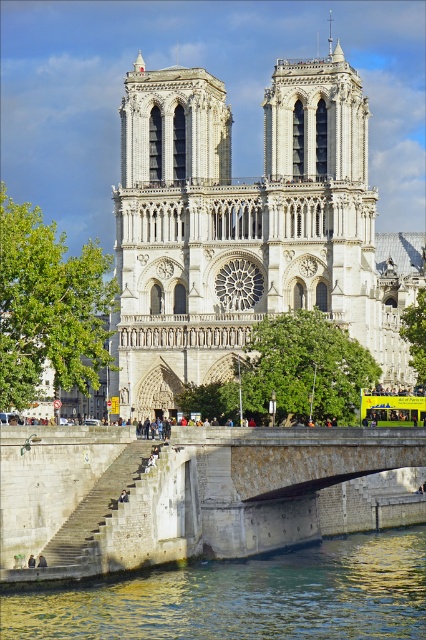
You are standing on the stone bridge at lower center and want to take a photo of the white stone cathedral at center. Which direction should you look to capture the cathedral in your photo?

You should look upward because the white stone cathedral at center is above the stone bridge at lower center.